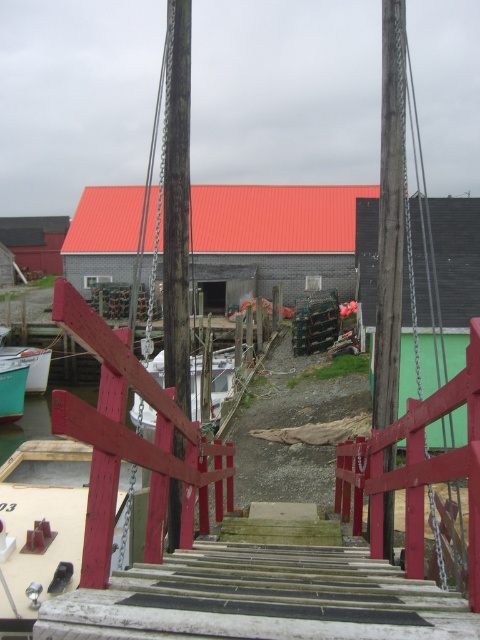
Question: In this image, where is wooden post at center located relative to green matte boat at lower left?

Choices:
 (A) above
 (B) below

Answer: (A)

Question: Is smooth wooden post at center thinner than green matte boat at lower left?

Choices:
 (A) no
 (B) yes

Answer: (A)

Question: Can you confirm if smooth wooden post at center is bigger than wooden post at center?

Choices:
 (A) no
 (B) yes

Answer: (A)

Question: Estimate the real-world distances between objects in this image. Which object is closer to the wooden post at center?

Choices:
 (A) smooth wooden post at center
 (B) green matte boat at lower left

Answer: (A)

Question: Which object appears farthest from the camera in this image?

Choices:
 (A) wooden post at center
 (B) smooth wooden post at center

Answer: (A)

Question: Which of the following is the closest to the observer?

Choices:
 (A) smooth wooden post at center
 (B) green matte boat at lower left

Answer: (A)